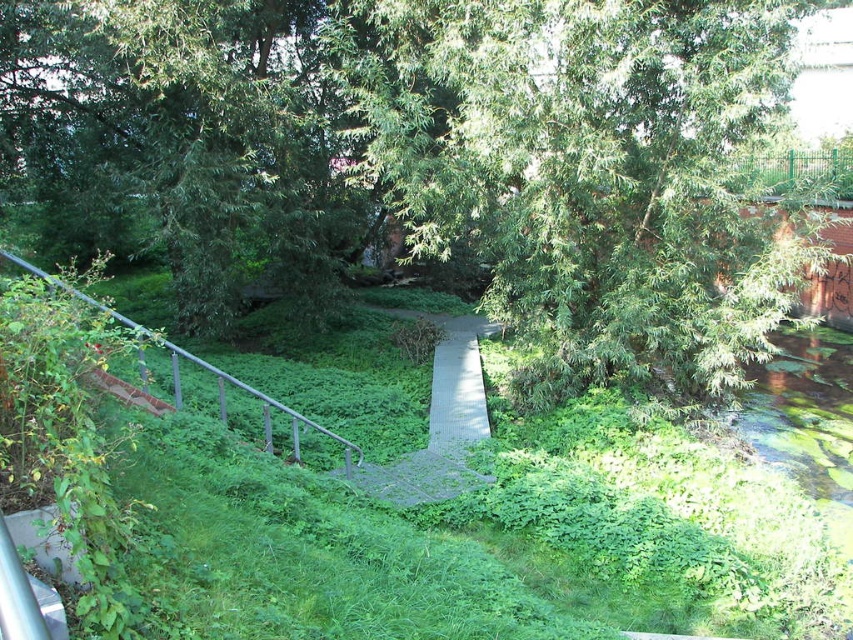
Question: Where is green leafy grass at center located in relation to gray textured boardwalk at center in the image?

Choices:
 (A) right
 (B) left

Answer: (B)

Question: Which point appears closest to the camera in this image?

Choices:
 (A) (270, 486)
 (B) (451, 339)
 (C) (410, 49)

Answer: (A)

Question: Does green leafy tree at center appear on the right side of gray textured boardwalk at center?

Choices:
 (A) yes
 (B) no

Answer: (B)

Question: Which point is farther from the camera taking this photo?

Choices:
 (A) (683, 598)
 (B) (775, 310)
 (C) (476, 352)
 (D) (143, 353)

Answer: (C)

Question: Is green leafy grass at center to the left of gray textured boardwalk at center from the viewer's perspective?

Choices:
 (A) yes
 (B) no

Answer: (A)

Question: Among these points, which one is nearest to the camera?

Choices:
 (A) (202, 280)
 (B) (479, 392)
 (C) (305, 422)
 (D) (643, 556)

Answer: (D)